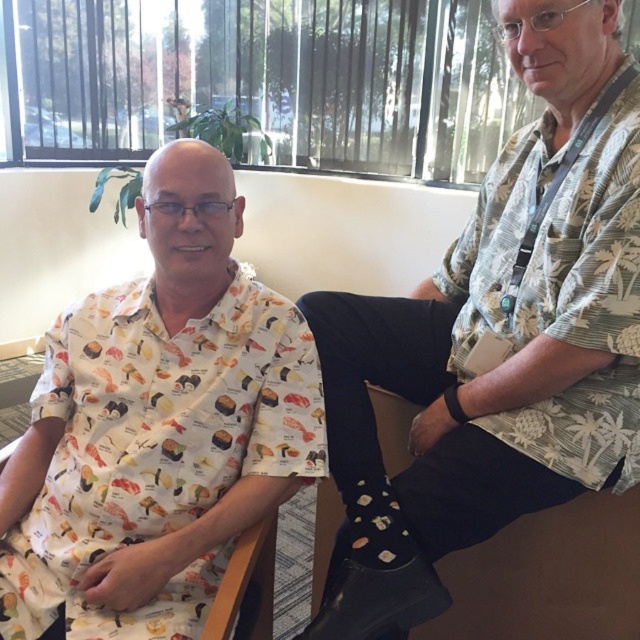
You are standing in a room and see two shirts. The first is a white printed shirt at center and the second is a green palm tree print shirt at upper right. Which shirt is taller?

The white printed shirt at center is much taller than the green palm tree print shirt at upper right.

You are a photographer setting up a shoot in this scene. You need to position a light source so it illuminates both the white printed shirt at center and the black fabric chair at lower right without casting shadows between them. Based on their positions, where should you place the light source?

The white printed shirt at center is in front of the black fabric chair at lower right, so placing the light source behind both objects would ensure it illuminates them without casting shadows between them.